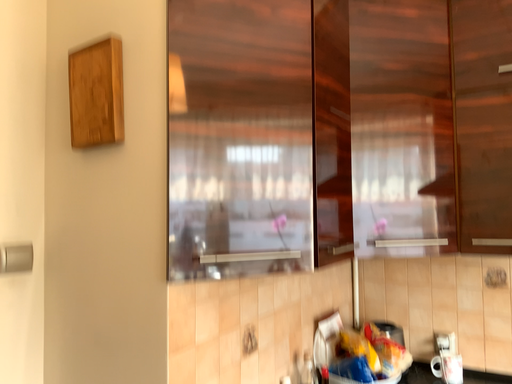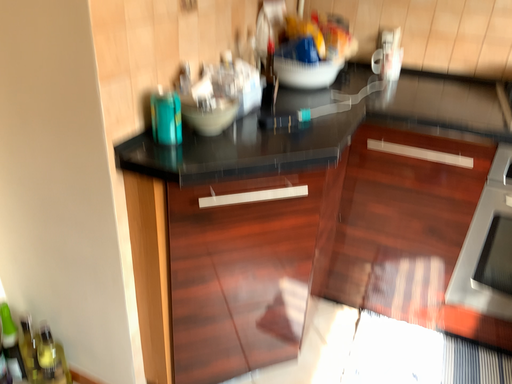
Question: How did the camera likely rotate when shooting the video?

Choices:
 (A) rotated upward
 (B) rotated downward

Answer: (B)